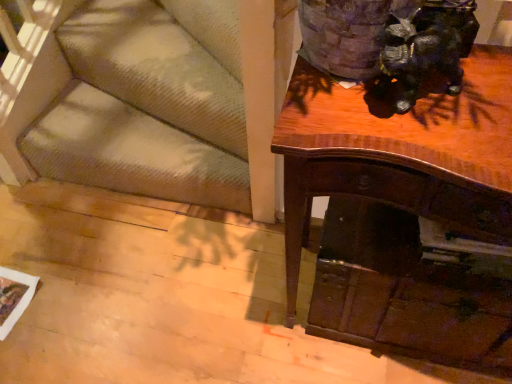
I want to click on vacant space situated on the left part of shiny black statue at upper right, so click(x=329, y=104).